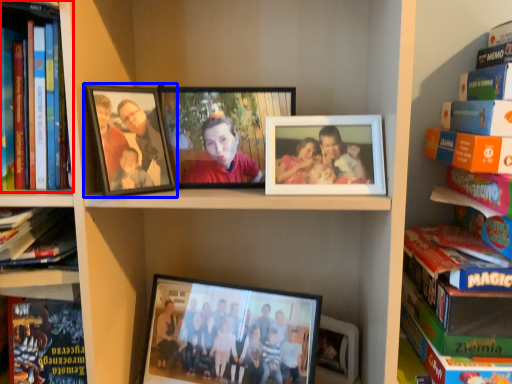
Question: Among these objects, which one is farthest to the camera, book (highlighted by a red box) or picture frame (highlighted by a blue box)?

Choices:
 (A) book
 (B) picture frame

Answer: (B)